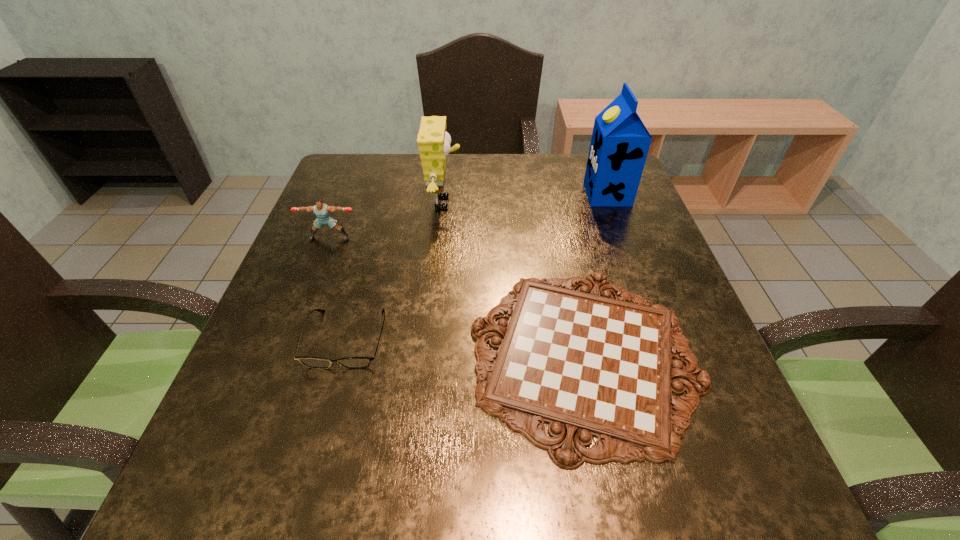
Locate an element on the screen. This screenshot has width=960, height=540. carton is located at coordinates (620, 142).

Where is `the third object from right to left`? the third object from right to left is located at coordinates (433, 141).

You are a GUI agent. You are given a task and a screenshot of the screen. Output one action in this format:
    pyautogui.click(x=<x>, y=<y>)
    Task: Click on the sponge
    
    Given the screenshot: What is the action you would take?
    pyautogui.click(x=433, y=141)

Where is `the third shortest object`? the third shortest object is located at coordinates (322, 211).

Image resolution: width=960 pixels, height=540 pixels. What are the coordinates of `puncher` in the screenshot? It's located at (322, 211).

Where is `the fourth tallest object`? the fourth tallest object is located at coordinates (311, 362).

This screenshot has width=960, height=540. In order to click on the shortest object in this screenshot , I will do `click(588, 365)`.

Where is `free space located 0.150m with the cap open on the carton`? The width and height of the screenshot is (960, 540). free space located 0.150m with the cap open on the carton is located at coordinates (531, 194).

The width and height of the screenshot is (960, 540). In order to click on vacant space located with the cap open on the carton in this screenshot , I will do `click(535, 194)`.

Locate an element on the screen. free space located with the cap open on the carton is located at coordinates click(505, 194).